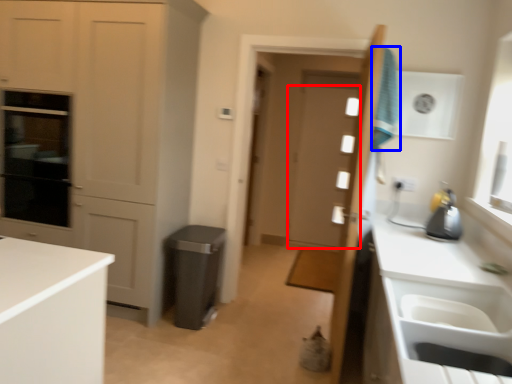
Question: Which point is closer to the camera, door (highlighted by a red box) or laundry (highlighted by a blue box)?

Choices:
 (A) door
 (B) laundry

Answer: (B)